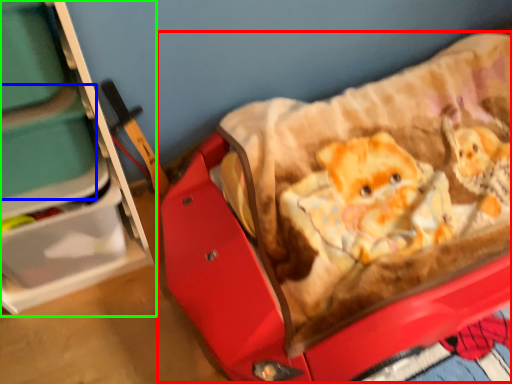
Question: Based on their relative distances, which object is nearer to baby carriage (highlighted by a red box)? Choose from storage box (highlighted by a blue box) and furniture (highlighted by a green box).

Choices:
 (A) storage box
 (B) furniture

Answer: (B)